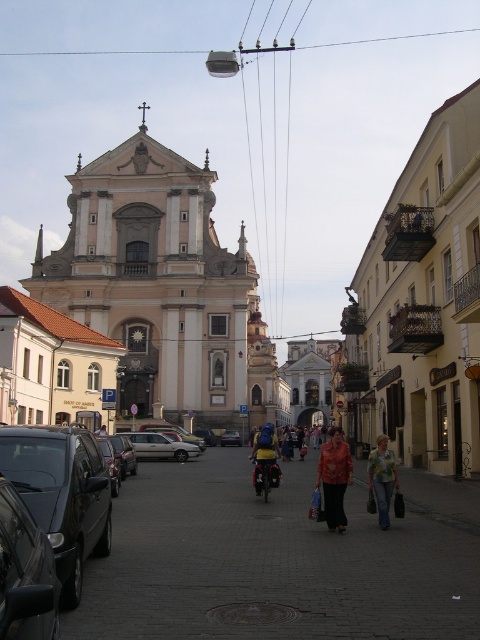
Question: Is white stone church at upper center to the left of metallic silver car at center from the viewer's perspective?

Choices:
 (A) yes
 (B) no

Answer: (A)

Question: Which object is positioned farthest from the yellow fabric backpack at center?

Choices:
 (A) shiny black van at left
 (B) shiny black car at left
 (C) metallic silver car at center

Answer: (B)

Question: Can you confirm if leather jacket at center is smaller than metallic silver car at center?

Choices:
 (A) yes
 (B) no

Answer: (B)

Question: Is yellow-green shirt at center in front of silver metallic sedan at center?

Choices:
 (A) yes
 (B) no

Answer: (A)

Question: Which of the following is the closest to the observer?

Choices:
 (A) yellow fabric backpack at center
 (B) yellow-green shirt at center
 (C) shiny black van at left
 (D) metallic wire at upper center

Answer: (C)

Question: Which point is farther from the camera taking this photo?

Choices:
 (A) (238, 438)
 (B) (90, 468)

Answer: (A)